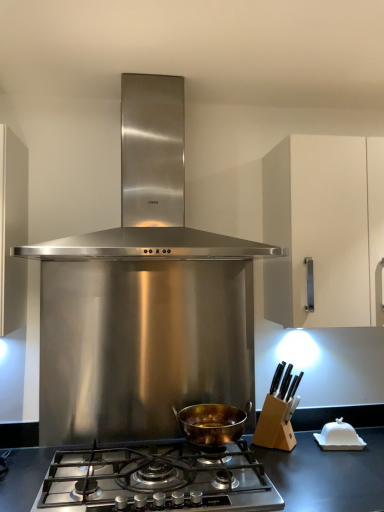
Question: Is stainless steel gas stove at center positioned far away from stainless steel range hood at center, which is counted as the 2th kitchen appliance, starting from the bottom?

Choices:
 (A) yes
 (B) no

Answer: (B)

Question: From a real-world perspective, is stainless steel gas stove at center located beneath stainless steel range hood at center, which ranks as the first kitchen appliance in top-to-bottom order?

Choices:
 (A) no
 (B) yes

Answer: (B)

Question: Could stainless steel range hood at center, which is counted as the 2th kitchen appliance, starting from the bottom, be considered to be inside stainless steel gas stove at center?

Choices:
 (A) no
 (B) yes

Answer: (A)

Question: Is stainless steel gas stove at center looking in the opposite direction of stainless steel range hood at center, which is counted as the 2th kitchen appliance, starting from the bottom?

Choices:
 (A) yes
 (B) no

Answer: (B)

Question: Is stainless steel gas stove at center not within stainless steel range hood at center, which ranks as the first kitchen appliance in top-to-bottom order?

Choices:
 (A) yes
 (B) no

Answer: (A)

Question: In terms of height, does stainless steel gas stove at center look taller or shorter compared to gold-bronze pot at center, which ranks as the second kitchen appliance in top-to-bottom order?

Choices:
 (A) tall
 (B) short

Answer: (B)

Question: From a real-world perspective, is stainless steel gas stove at center physically located above or below gold-bronze pot at center, which ranks as the 1th kitchen appliance in bottom-to-top order?

Choices:
 (A) below
 (B) above

Answer: (A)

Question: In terms of width, does stainless steel gas stove at center look wider or thinner when compared to gold-bronze pot at center, which ranks as the second kitchen appliance in top-to-bottom order?

Choices:
 (A) wide
 (B) thin

Answer: (A)

Question: Looking at the image, does stainless steel gas stove at center seem bigger or smaller compared to gold-bronze pot at center, which ranks as the second kitchen appliance in top-to-bottom order?

Choices:
 (A) big
 (B) small

Answer: (A)

Question: Is stainless steel gas stove at center wider or thinner than stainless steel range hood at center, which is counted as the 2th kitchen appliance, starting from the bottom?

Choices:
 (A) wide
 (B) thin

Answer: (A)

Question: From the image's perspective, relative to stainless steel range hood at center, which ranks as the first kitchen appliance in top-to-bottom order, is stainless steel gas stove at center above or below?

Choices:
 (A) above
 (B) below

Answer: (B)

Question: From a real-world perspective, is stainless steel gas stove at center physically located above or below stainless steel range hood at center, which ranks as the first kitchen appliance in top-to-bottom order?

Choices:
 (A) above
 (B) below

Answer: (B)

Question: From their relative heights in the image, would you say stainless steel gas stove at center is taller or shorter than stainless steel range hood at center, which ranks as the first kitchen appliance in top-to-bottom order?

Choices:
 (A) short
 (B) tall

Answer: (A)

Question: In terms of width, does gold-bronze pot at center, which ranks as the second kitchen appliance in top-to-bottom order, look wider or thinner when compared to white matte cabinet at right?

Choices:
 (A) thin
 (B) wide

Answer: (A)

Question: Does point (220, 412) appear closer or farther from the camera than point (339, 217)?

Choices:
 (A) farther
 (B) closer

Answer: (A)